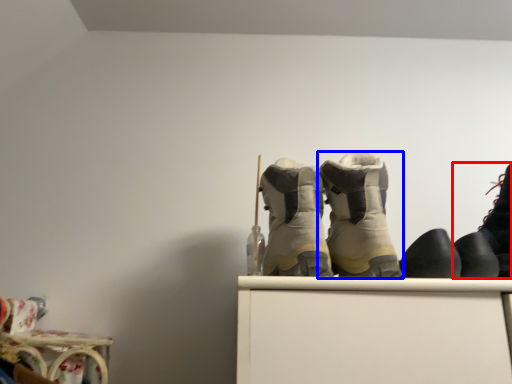
Question: Which of the following is the closest to the observer, footwear (highlighted by a red box) or footwear (highlighted by a blue box)?

Choices:
 (A) footwear
 (B) footwear

Answer: (A)